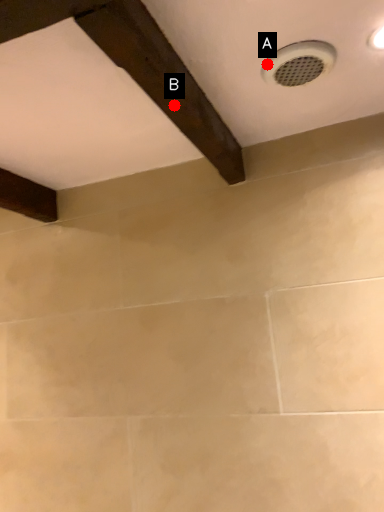
Question: Two points are circled on the image, labeled by A and B beside each circle. Which point appears closest to the camera in this image?

Choices:
 (A) A is closer
 (B) B is closer

Answer: (B)